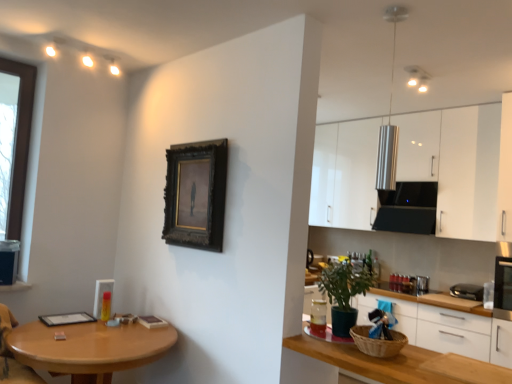
Question: Can you confirm if wooden table at lower left is positioned to the left of green matte plant at lower right?

Choices:
 (A) no
 (B) yes

Answer: (B)

Question: From the image's perspective, is wooden table at lower left beneath green matte plant at lower right?

Choices:
 (A) no
 (B) yes

Answer: (B)

Question: Does wooden table at lower left turn towards green matte plant at lower right?

Choices:
 (A) no
 (B) yes

Answer: (A)

Question: Considering the relative sizes of wooden table at lower left and green matte plant at lower right in the image provided, is wooden table at lower left bigger than green matte plant at lower right?

Choices:
 (A) yes
 (B) no

Answer: (A)

Question: Does wooden table at lower left come behind green matte plant at lower right?

Choices:
 (A) yes
 (B) no

Answer: (B)

Question: From a real-world perspective, is wooden table at lower left under green matte plant at lower right?

Choices:
 (A) no
 (B) yes

Answer: (B)

Question: From the image's perspective, is black plastic toaster at right below white glossy cabinets at upper right, the first cabinetry in the top-to-bottom sequence?

Choices:
 (A) yes
 (B) no

Answer: (A)

Question: Is black plastic toaster at right not close to white glossy cabinets at upper right, positioned as the second cabinetry in bottom-to-top order?

Choices:
 (A) yes
 (B) no

Answer: (A)

Question: From a real-world perspective, is black plastic toaster at right beneath white glossy cabinets at upper right, the first cabinetry in the top-to-bottom sequence?

Choices:
 (A) yes
 (B) no

Answer: (A)

Question: Does black plastic toaster at right have a lesser height compared to white glossy cabinets at upper right, positioned as the second cabinetry in bottom-to-top order?

Choices:
 (A) no
 (B) yes

Answer: (B)

Question: Can you confirm if black plastic toaster at right is positioned to the left of white glossy cabinets at upper right, positioned as the second cabinetry in bottom-to-top order?

Choices:
 (A) no
 (B) yes

Answer: (A)

Question: Does black plastic toaster at right lie behind white glossy cabinets at upper right, positioned as the second cabinetry in bottom-to-top order?

Choices:
 (A) yes
 (B) no

Answer: (B)

Question: Can you confirm if white glossy cabinets at upper right, positioned as the second cabinetry in bottom-to-top order, is shorter than dark wood picture frame at center?

Choices:
 (A) yes
 (B) no

Answer: (B)